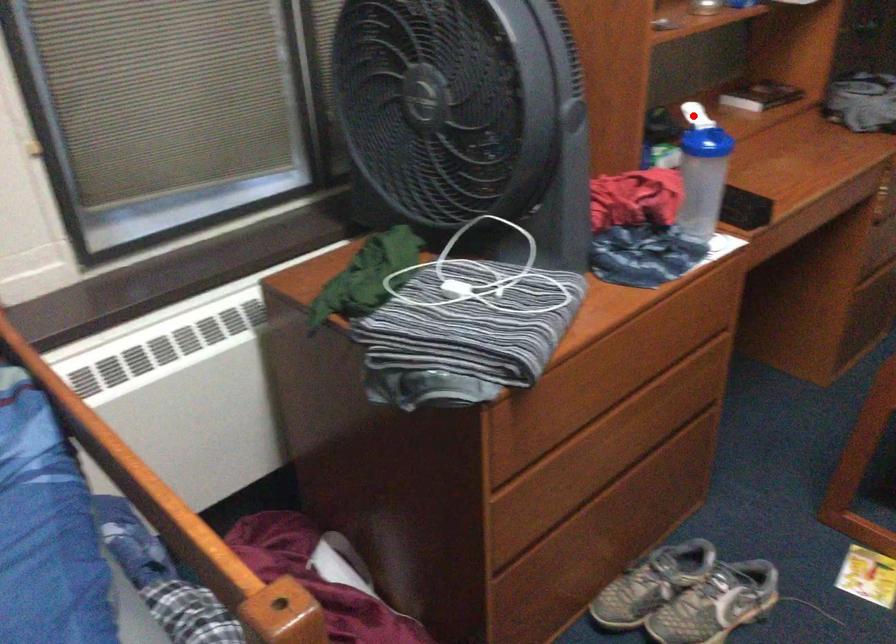
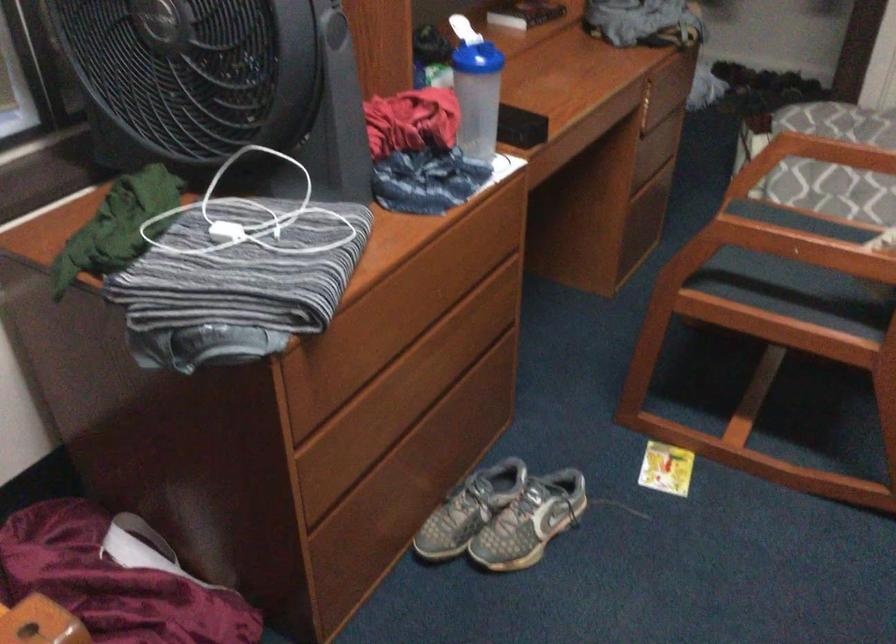
Where in the second image is the point corresponding to the highlighted location from the first image?

(462, 29)